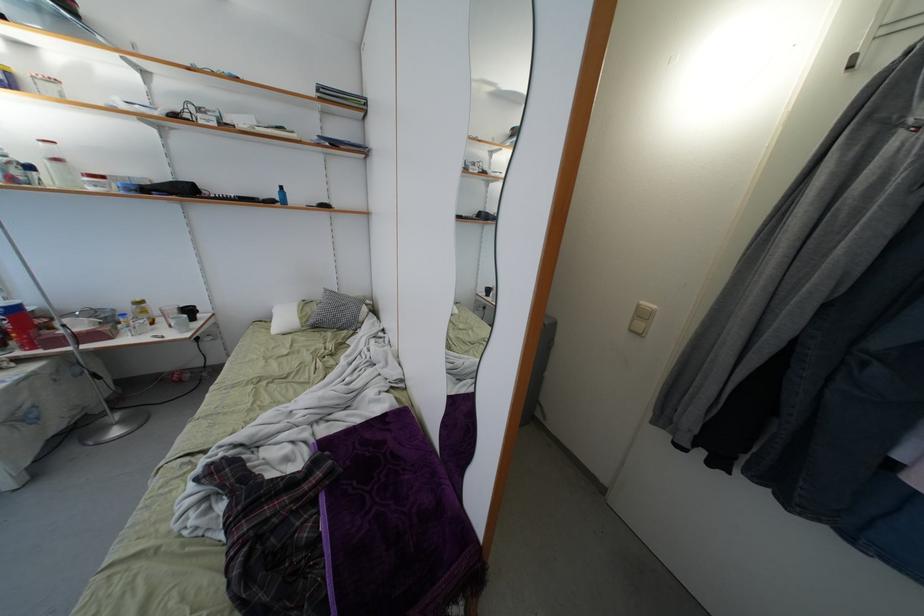
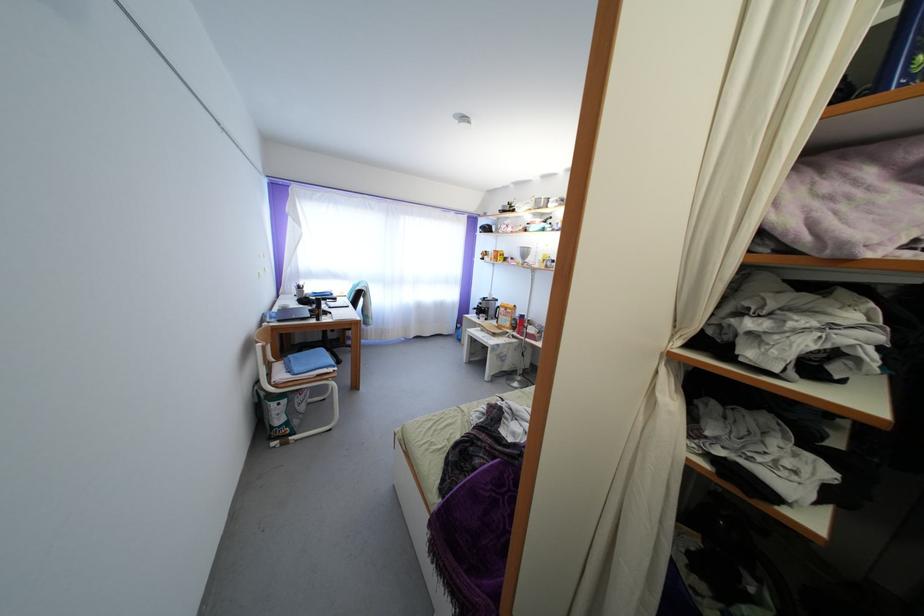
Question: The camera is either moving clockwise (left) or counter-clockwise (right) around the object. The first image is from the beginning of the video and the second image is from the end. Is the camera moving left or right when shooting the video?

Choices:
 (A) Left
 (B) Right

Answer: (B)